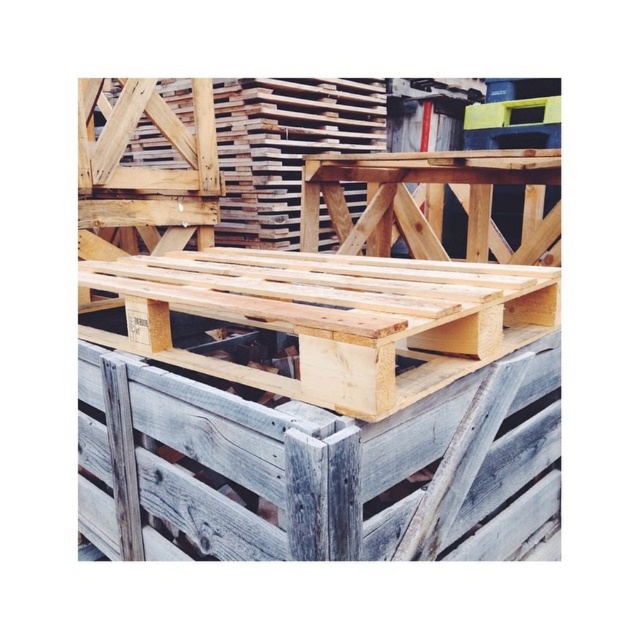
Question: From the image, what is the correct spatial relationship of natural light wood pallet at center in relation to weathered gray wood at center?

Choices:
 (A) right
 (B) left

Answer: (B)

Question: Does natural light wood pallet at center appear over weathered gray wood at center?

Choices:
 (A) yes
 (B) no

Answer: (A)

Question: Does natural light wood pallet at center have a greater width compared to weathered gray wood at center?

Choices:
 (A) yes
 (B) no

Answer: (A)

Question: Which object appears farthest from the camera in this image?

Choices:
 (A) weathered gray wood at center
 (B) natural light wood pallet at center

Answer: (B)